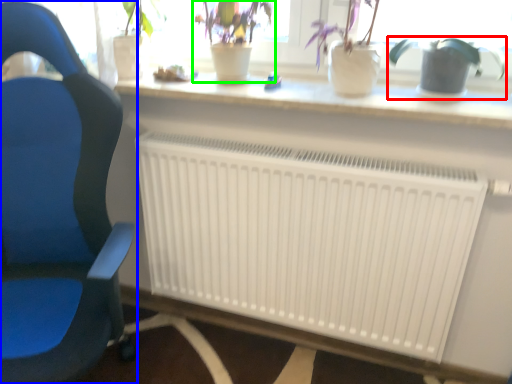
Question: Estimate the real-world distances between objects in this image. Which object is closer to houseplant (highlighted by a red box), chair (highlighted by a blue box) or houseplant (highlighted by a green box)?

Choices:
 (A) chair
 (B) houseplant

Answer: (B)